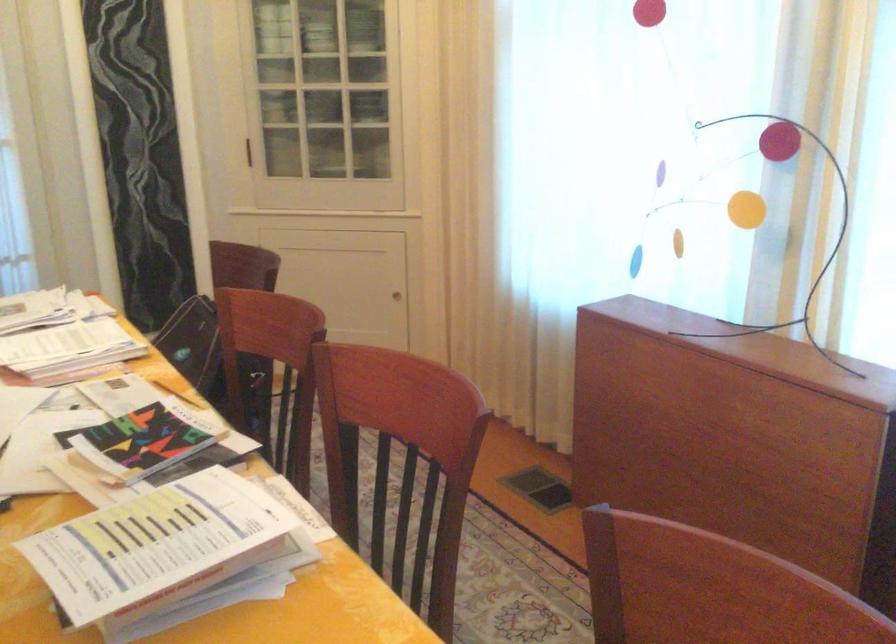
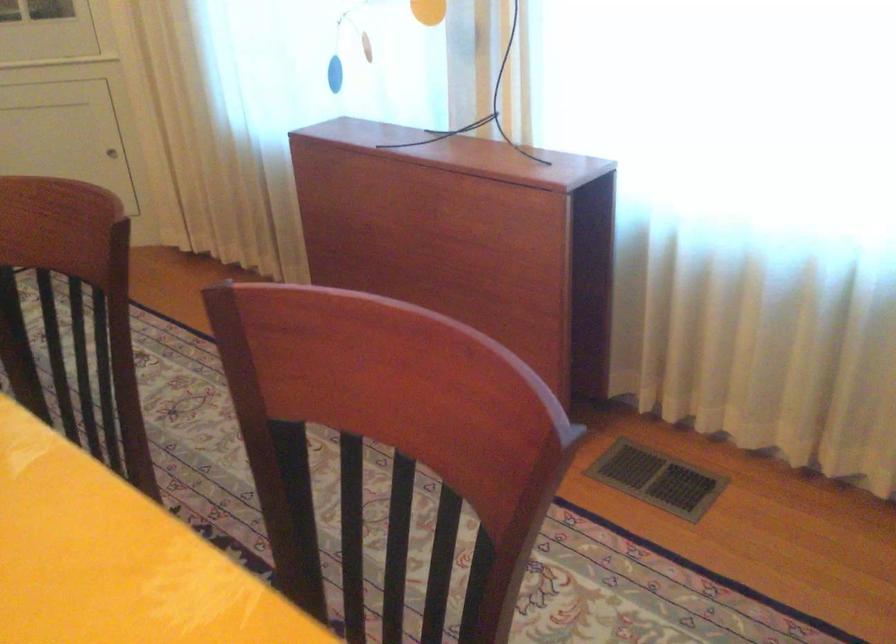
Question: Based on the continuous images, in which direction is the camera rotating? Reply with the corresponding letter.

Choices:
 (A) Left
 (B) Right
 (C) Up
 (D) Down

Answer: (B)